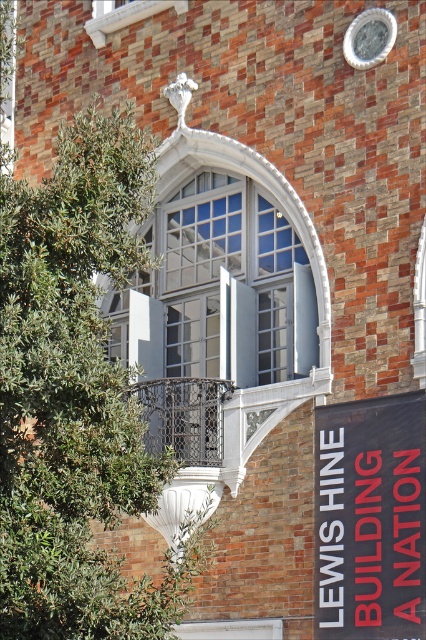
Question: Which point appears farthest from the camera in this image?

Choices:
 (A) (98, 131)
 (B) (373, 20)
 (C) (388, 595)

Answer: (B)

Question: Can you confirm if black fabric banner at lower right is positioned above silver metallic clock at upper center?

Choices:
 (A) no
 (B) yes

Answer: (A)

Question: Which object is positioned farthest from the black fabric banner at lower right?

Choices:
 (A) silver metallic clock at upper center
 (B) green leafy tree at left

Answer: (B)

Question: Which point is closer to the camera?

Choices:
 (A) (347, 32)
 (B) (40, 595)
 (C) (377, 529)

Answer: (B)

Question: Does green leafy tree at left have a lesser width compared to silver metallic clock at upper center?

Choices:
 (A) yes
 (B) no

Answer: (B)

Question: Does green leafy tree at left have a smaller size compared to silver metallic clock at upper center?

Choices:
 (A) yes
 (B) no

Answer: (B)